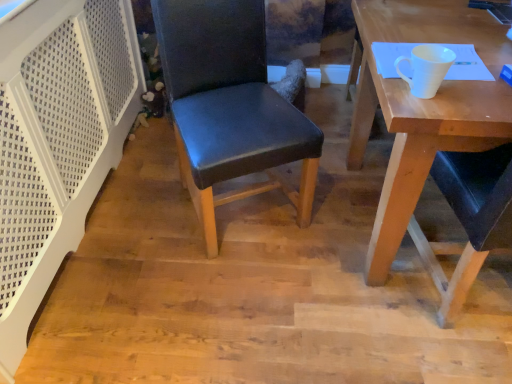
Find the location of a particular element. The height and width of the screenshot is (384, 512). free point in front of black leather chair at center is located at coordinates (230, 295).